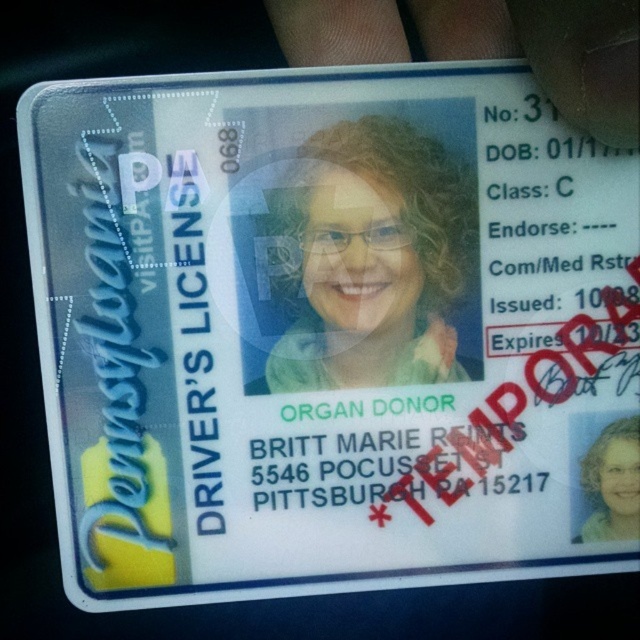
Who is positioned more to the left, matte plastic photo at center or light brown hair at center?

matte plastic photo at center

Find the location of a particular element. matte plastic photo at center is located at coordinates (372, 259).

Is point (394, 342) positioned behind point (598, 467)?

No, (394, 342) is in front of (598, 467).

Locate an element on the screen. The width and height of the screenshot is (640, 640). matte plastic photo at center is located at coordinates (372, 259).

Can you confirm if matte plastic photo at center is smaller than transparent plastic hand at upper center?

Correct, matte plastic photo at center occupies less space than transparent plastic hand at upper center.

Does matte plastic photo at center appear on the right side of transparent plastic hand at upper center?

Incorrect, matte plastic photo at center is not on the right side of transparent plastic hand at upper center.

Is point (444, 369) more distant than point (577, 108)?

Yes, point (444, 369) is behind point (577, 108).

At what (x,y) coordinates should I click in order to perform the action: click on matte plastic photo at center. Please return your answer as a coordinate pair (x, y). The width and height of the screenshot is (640, 640). Looking at the image, I should click on 372,259.

What do you see at coordinates (550, 52) in the screenshot? This screenshot has width=640, height=640. I see `transparent plastic hand at upper center` at bounding box center [550, 52].

Is point (340, 17) closer to viewer compared to point (609, 484)?

Yes.

What do you see at coordinates (550, 52) in the screenshot? I see `transparent plastic hand at upper center` at bounding box center [550, 52].

Find the location of a particular element. The image size is (640, 640). transparent plastic hand at upper center is located at coordinates (550, 52).